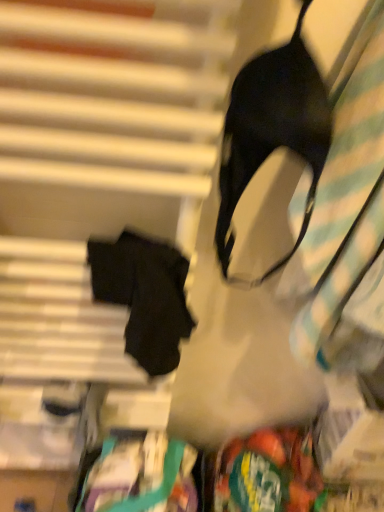
Question: In terms of size, does black matte fabric robe at left appear bigger or smaller than green plastic bag at lower right?

Choices:
 (A) big
 (B) small

Answer: (B)

Question: Would you say black matte fabric robe at left is to the left or to the right of green plastic bag at lower right in the picture?

Choices:
 (A) left
 (B) right

Answer: (A)

Question: Based on their relative distances, which object is farther from the black matte bra at upper right?

Choices:
 (A) green plastic bag at lower right
 (B) black matte fabric robe at left

Answer: (A)

Question: Considering the real-world distances, which object is farthest from the black matte bra at upper right?

Choices:
 (A) black matte fabric robe at left
 (B) green plastic bag at lower right

Answer: (B)